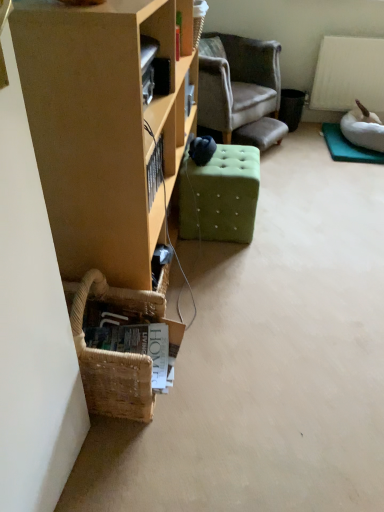
Question: Can you confirm if matte wood cabinet at left is positioned to the right of green tufted ottoman at center?

Choices:
 (A) no
 (B) yes

Answer: (A)

Question: From a real-world perspective, does matte wood cabinet at left stand above green tufted ottoman at center?

Choices:
 (A) yes
 (B) no

Answer: (A)

Question: Is matte wood cabinet at left aimed at green tufted ottoman at center?

Choices:
 (A) yes
 (B) no

Answer: (A)

Question: From the image's perspective, is matte wood cabinet at left below green tufted ottoman at center?

Choices:
 (A) yes
 (B) no

Answer: (B)

Question: From the image's perspective, is matte wood cabinet at left on green tufted ottoman at center?

Choices:
 (A) yes
 (B) no

Answer: (A)

Question: Is there a large distance between matte wood cabinet at left and green tufted ottoman at center?

Choices:
 (A) no
 (B) yes

Answer: (A)

Question: Does velvet gray armchair at center come in front of matte wood cabinet at left?

Choices:
 (A) yes
 (B) no

Answer: (B)

Question: Does velvet gray armchair at center appear on the left side of matte wood cabinet at left?

Choices:
 (A) no
 (B) yes

Answer: (A)

Question: From a real-world perspective, is velvet gray armchair at center located higher than matte wood cabinet at left?

Choices:
 (A) no
 (B) yes

Answer: (A)

Question: Is velvet gray armchair at center not near matte wood cabinet at left?

Choices:
 (A) no
 (B) yes

Answer: (B)

Question: From the image's perspective, would you say velvet gray armchair at center is shown under matte wood cabinet at left?

Choices:
 (A) yes
 (B) no

Answer: (B)

Question: Is velvet gray armchair at center wider than matte wood cabinet at left?

Choices:
 (A) yes
 (B) no

Answer: (A)

Question: Would you say green tufted ottoman at center contains matte wood cabinet at left?

Choices:
 (A) yes
 (B) no

Answer: (B)